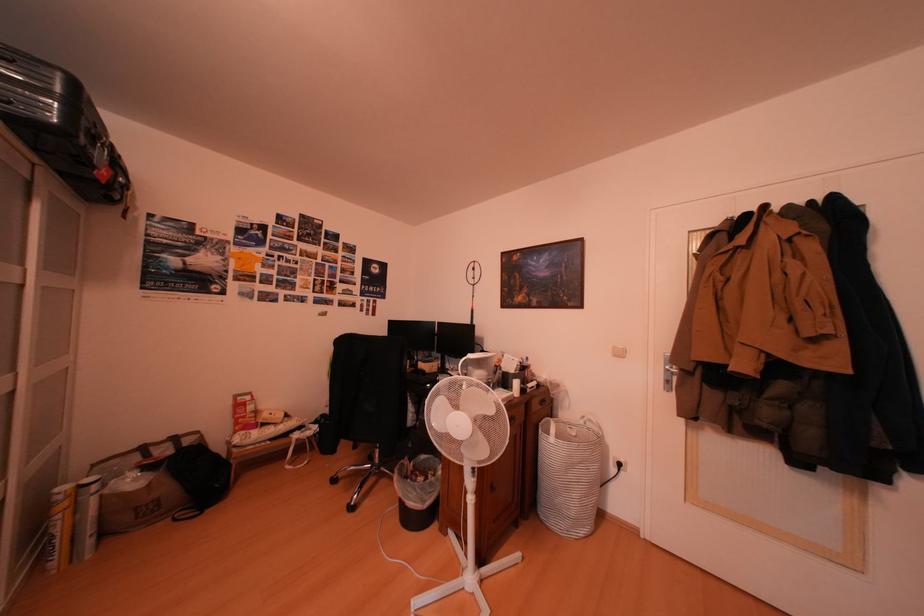
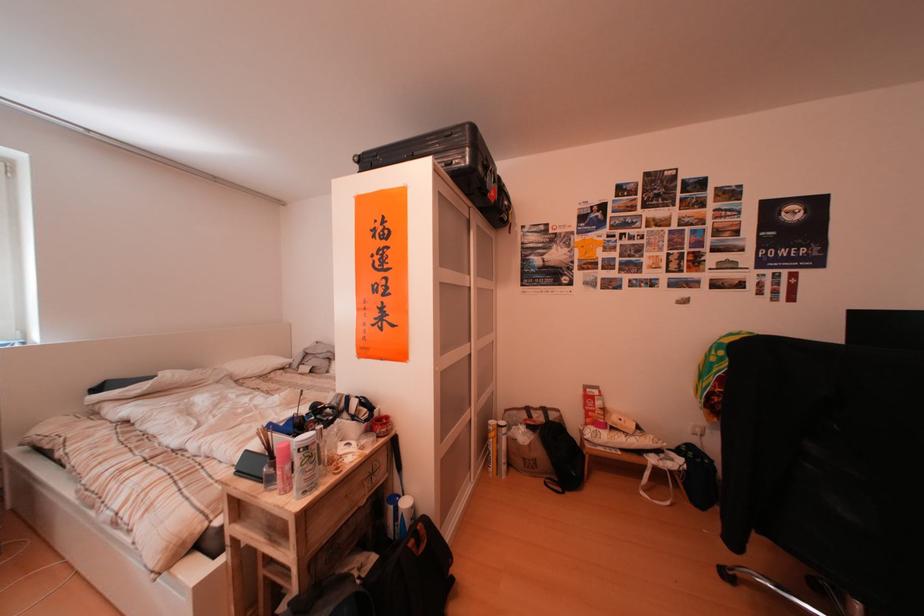
In the second image, find the point that corresponds to point 156,454 in the first image.

(541, 415)